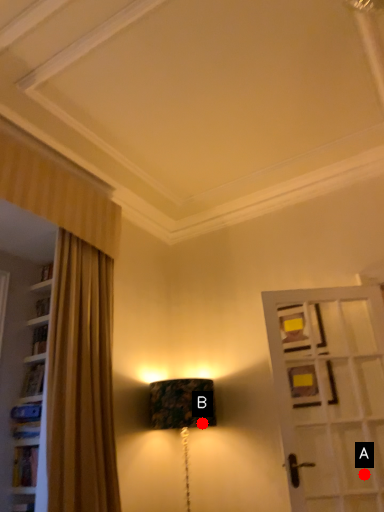
Question: Two points are circled on the image, labeled by A and B beside each circle. Which of the following is the farthest from the observer?

Choices:
 (A) A is further
 (B) B is further

Answer: (B)